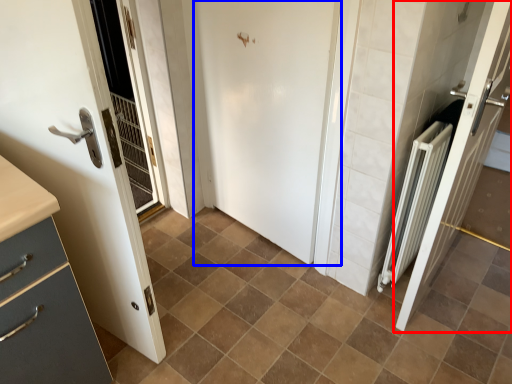
Question: Which of the following is the closest to the observer, door (highlighted by a red box) or door (highlighted by a blue box)?

Choices:
 (A) door
 (B) door

Answer: (A)